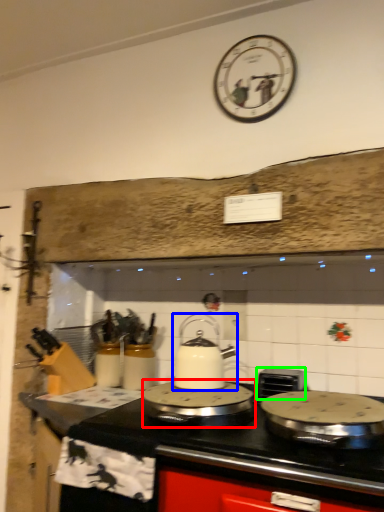
Question: Which object is positioned closest to kitchen appliance (highlighted by a red box)? Select from kitchen appliance (highlighted by a blue box) and appliance (highlighted by a green box).

Choices:
 (A) kitchen appliance
 (B) appliance

Answer: (A)